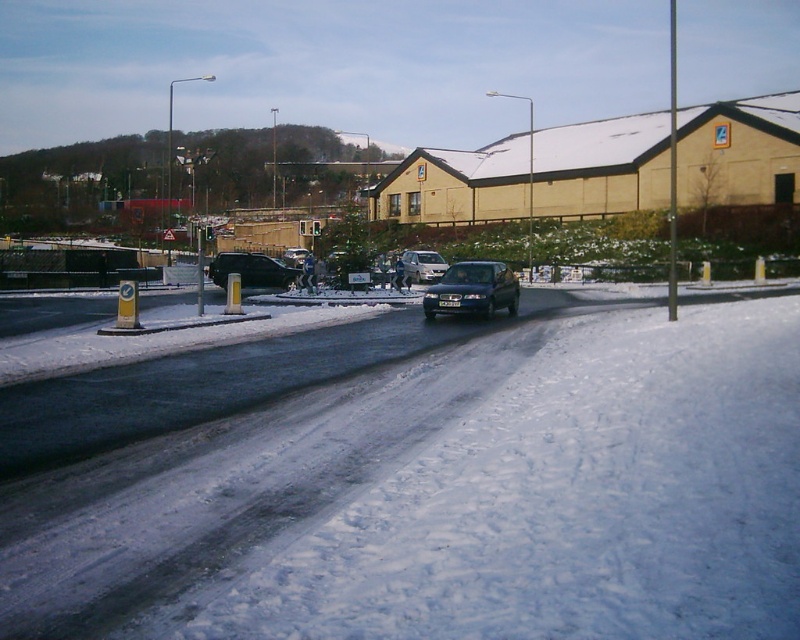
You are standing at point A, which is at coordinates point (308, 252). You want to walk to point B, which is at coordinates point (250, 252). According to the scene description, which direction should you move to reach point B from point A?

You should move forward because point B is behind point A, so moving forward from point A will lead you to point B.

You are standing at point (x=262, y=275) and want to walk to the car on the road. Is the car closer to you or further away than point (x=470, y=305)?

The car is closer to you than point (x=470, y=305) because point (x=470, y=305) is in front of point (x=262, y=275), meaning the car is between you and that point.